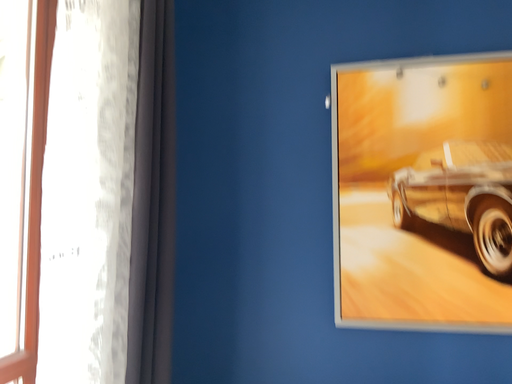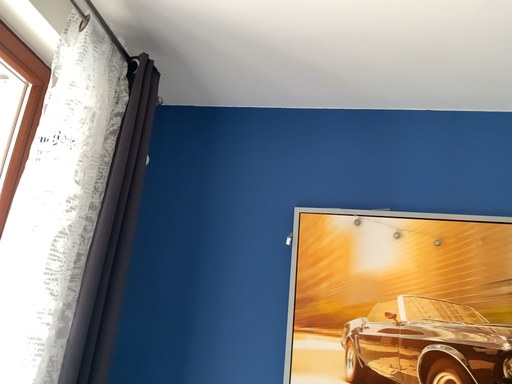
Question: How did the camera likely rotate when shooting the video?

Choices:
 (A) rotated upward
 (B) rotated downward

Answer: (A)